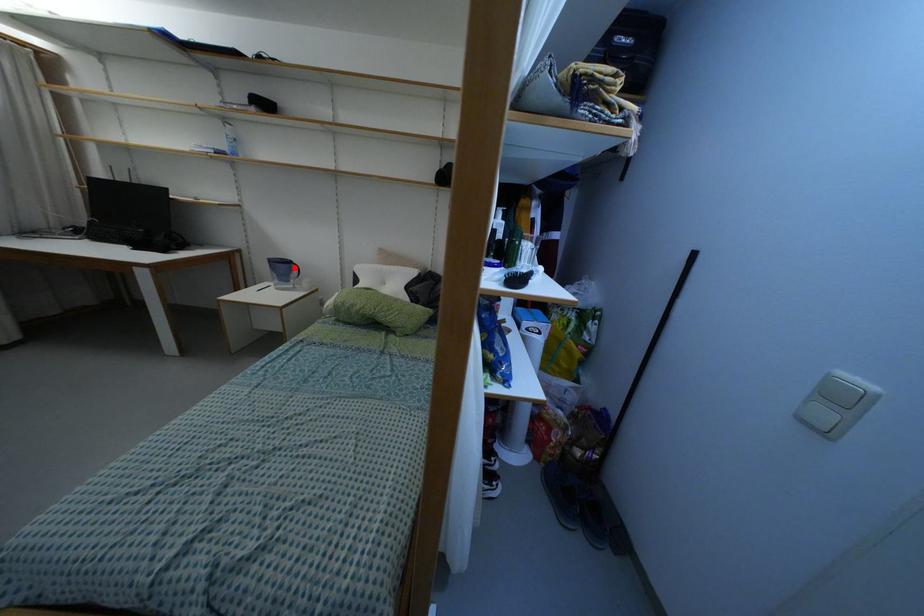
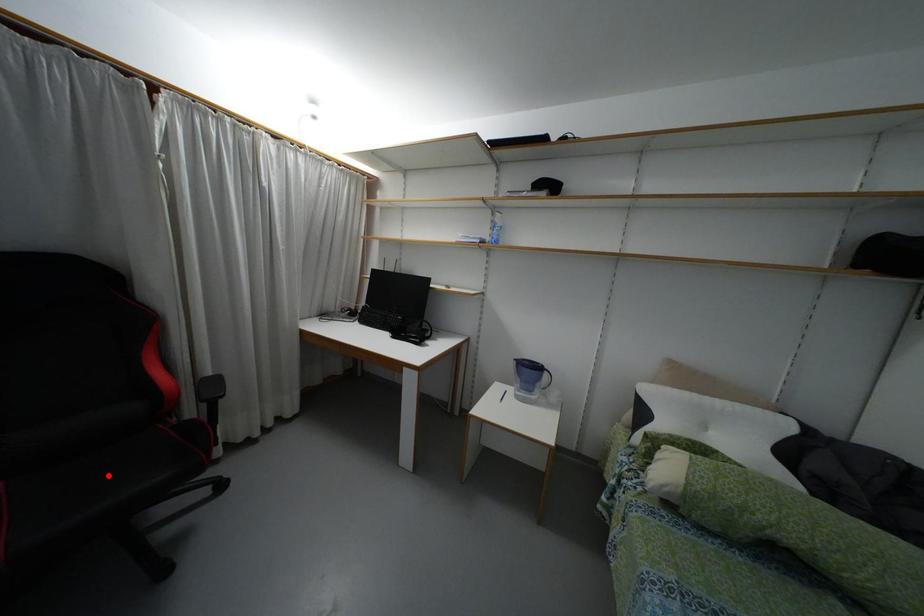
I am providing you with two images of the same scene from different viewpoints. A red point is marked on the first image and another point is marked on the second image. Is the marked point in image1 the same physical position as the marked point in image2?

No